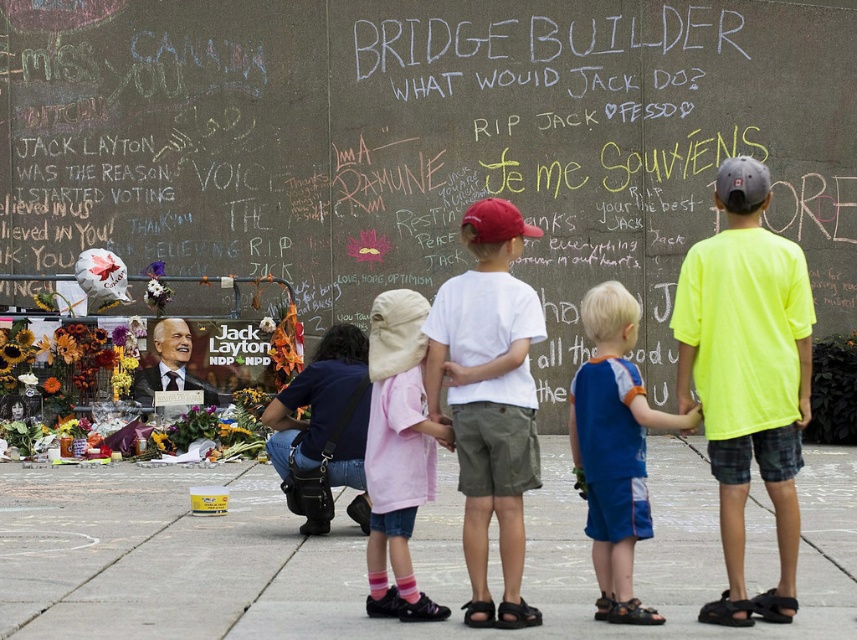
Which is behind, point (543, 100) or point (408, 618)?

The point (543, 100) is more distant.

This screenshot has width=857, height=640. What do you see at coordinates (426, 144) in the screenshot? I see `chalkboard at center` at bounding box center [426, 144].

This screenshot has height=640, width=857. Describe the element at coordinates (426, 144) in the screenshot. I see `chalkboard at center` at that location.

I want to click on chalkboard at center, so click(x=426, y=144).

Is gray concrete pavement at lower center below white cotton shirt at center?

Yes, gray concrete pavement at lower center is below white cotton shirt at center.

Consider the image. Can you confirm if gray concrete pavement at lower center is positioned to the right of white cotton shirt at center?

Correct, you'll find gray concrete pavement at lower center to the right of white cotton shirt at center.

Which is behind, point (88, 564) or point (481, 573)?

The point (88, 564) is behind.

Identify the location of gray concrete pavement at lower center. The width and height of the screenshot is (857, 640). (345, 557).

Is chalkboard at center wider than gray concrete pavement at lower center?

Indeed, chalkboard at center has a greater width compared to gray concrete pavement at lower center.

Can you confirm if chalkboard at center is taller than gray concrete pavement at lower center?

Yes, chalkboard at center is taller than gray concrete pavement at lower center.

Is point (658, 218) less distant than point (37, 529)?

No, it is behind (37, 529).

Where is `chalkboard at center`? chalkboard at center is located at coordinates (426, 144).